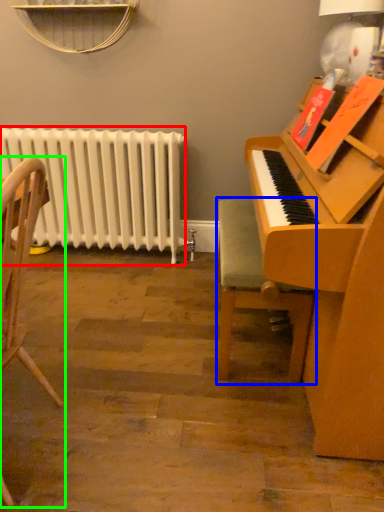
Question: Which object is the farthest from radiator (highlighted by a red box)? Choose among these: chair (highlighted by a blue box) or chair (highlighted by a green box).

Choices:
 (A) chair
 (B) chair

Answer: (B)